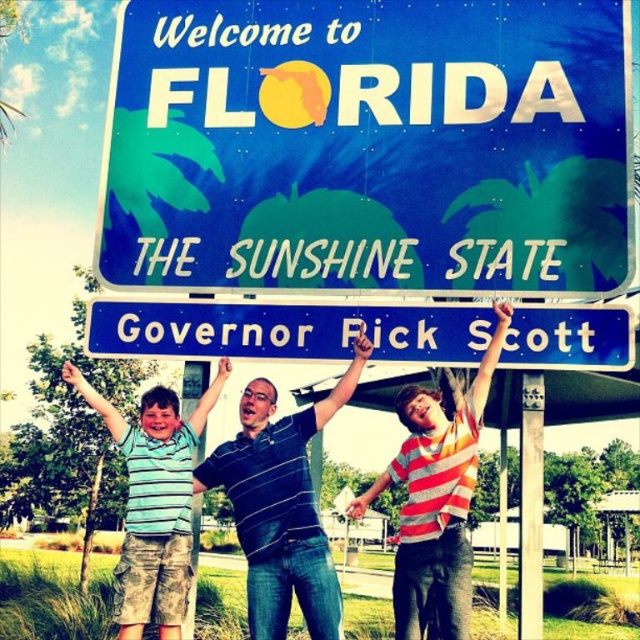
Question: Can you confirm if white painted wood pole at center is positioned to the right of metallic pole at center?

Choices:
 (A) yes
 (B) no

Answer: (A)

Question: Among these points, which one is farthest from the camera?

Choices:
 (A) (428, 404)
 (B) (113, 422)
 (C) (499, 198)
 (D) (200, 444)

Answer: (D)

Question: Which point is farther to the camera?

Choices:
 (A) (413, 340)
 (B) (454, 625)

Answer: (B)

Question: Does white painted wood pole at center have a greater width compared to metallic pole at center?

Choices:
 (A) yes
 (B) no

Answer: (B)

Question: Among these objects, which one is farthest from the camera?

Choices:
 (A) striped polo shirt at center
 (B) green striped shirt at center

Answer: (B)

Question: Can you confirm if blue glossy sign at upper center is wider than striped shirt at center?

Choices:
 (A) no
 (B) yes

Answer: (B)